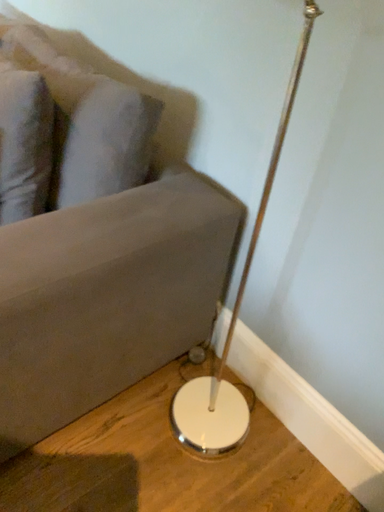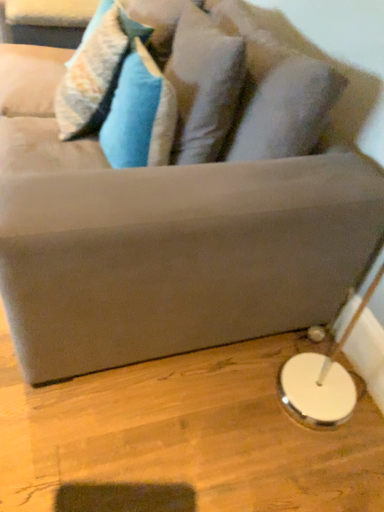
Question: How did the camera likely rotate when shooting the video?

Choices:
 (A) rotated left
 (B) rotated right

Answer: (A)